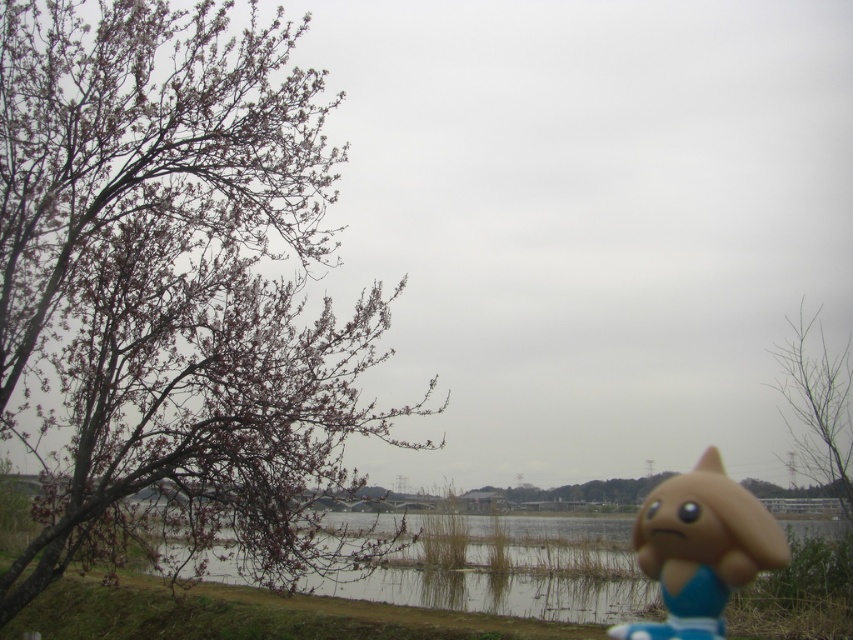
Question: Is clear water at lake right positioned in front of bare branches at upper right?

Choices:
 (A) no
 (B) yes

Answer: (B)

Question: Does clear water at lake right have a lesser width compared to matte plastic toy at lower right?

Choices:
 (A) no
 (B) yes

Answer: (A)

Question: Does bare branches at left come in front of clear water at lake right?

Choices:
 (A) yes
 (B) no

Answer: (A)

Question: Which object appears farthest from the camera in this image?

Choices:
 (A) clear water at lake right
 (B) bare branches at left

Answer: (A)

Question: Which point is farther to the camera?

Choices:
 (A) (787, 452)
 (B) (581, 524)
 (C) (714, 452)

Answer: (B)

Question: Estimate the real-world distances between objects in this image. Which object is closer to the bare branches at left?

Choices:
 (A) clear water at lake right
 (B) bare branches at upper right

Answer: (A)